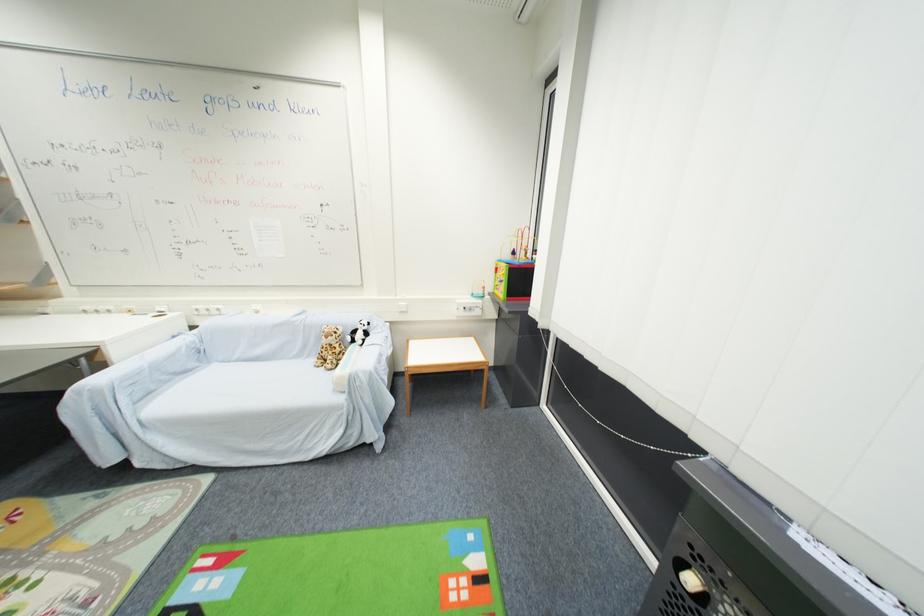
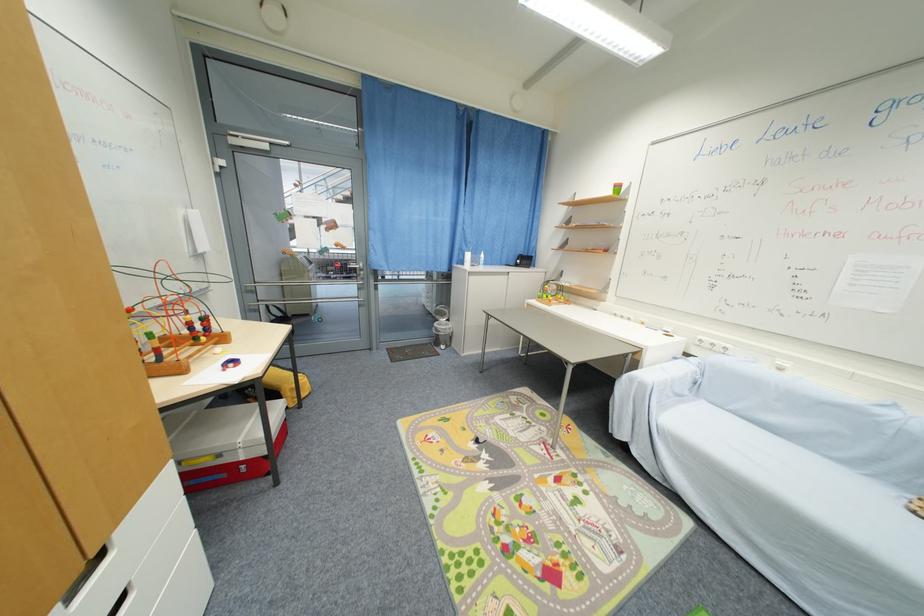
Question: Based on the continuous images, in which direction is the camera rotating? Reply with the corresponding letter.

Choices:
 (A) Left
 (B) Right
 (C) Up
 (D) Down

Answer: (A)